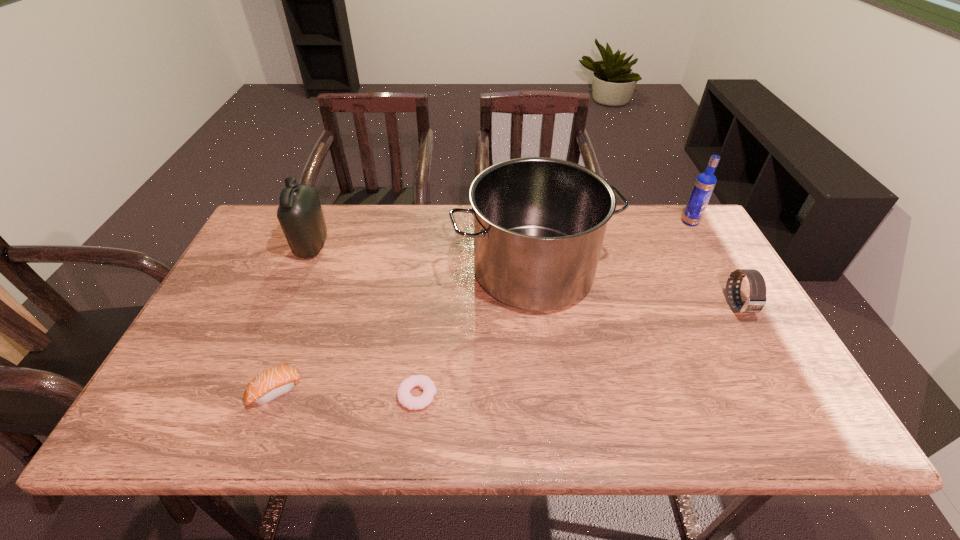
This screenshot has height=540, width=960. I want to click on free space located on the face of the watch, so click(x=802, y=421).

Where is `vacant space located on the right of the second shortest object`? vacant space located on the right of the second shortest object is located at coordinates (439, 392).

The width and height of the screenshot is (960, 540). Find the location of `vacant space located 0.180m on the left of the shortest object`. vacant space located 0.180m on the left of the shortest object is located at coordinates (317, 395).

Find the location of a particular element. The height and width of the screenshot is (540, 960). saucepan at the far edge is located at coordinates (539, 223).

Find the location of a particular element. This screenshot has height=540, width=960. bottle at the far edge is located at coordinates (299, 213).

This screenshot has height=540, width=960. Find the location of `vodka present at the far edge`. vodka present at the far edge is located at coordinates (704, 185).

Locate an element on the screen. The height and width of the screenshot is (540, 960). sushi that is at the near edge is located at coordinates (269, 385).

Identify the location of doughnut at the near edge. The image size is (960, 540). (405, 398).

Identify the location of object present at the left edge. The image size is (960, 540). (299, 213).

The image size is (960, 540). Find the location of `vodka that is positioned at the right edge`. vodka that is positioned at the right edge is located at coordinates (704, 185).